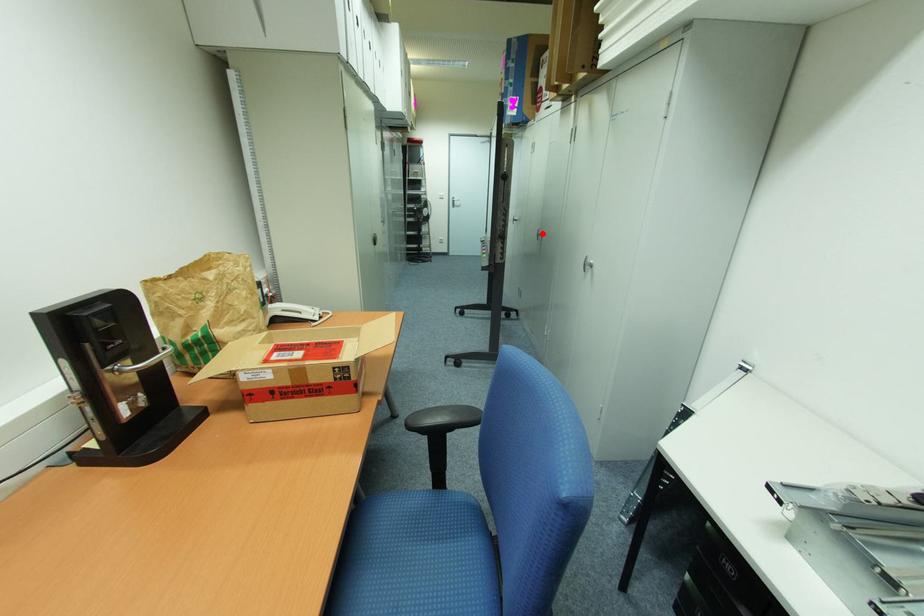
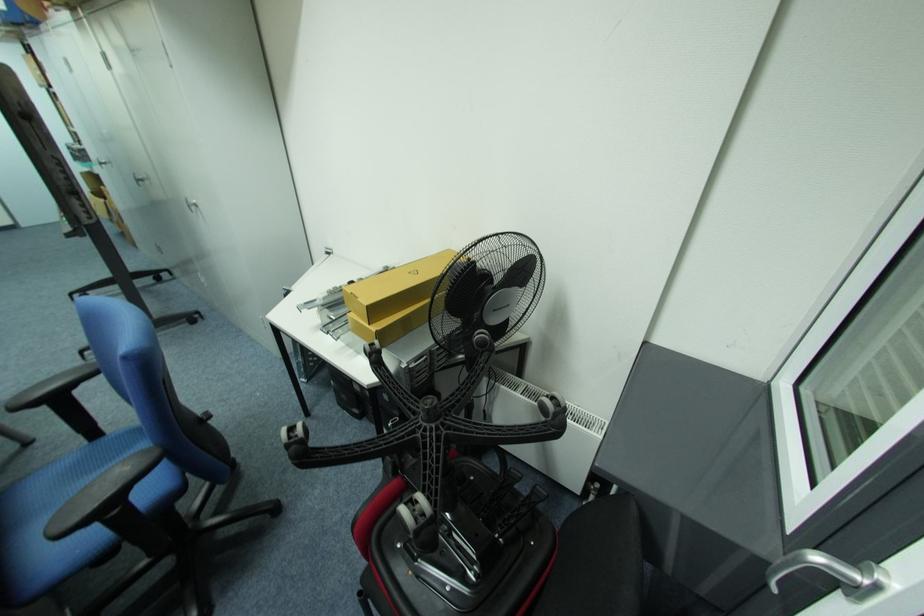
Where in the second image is the point corresponding to the highlighted location from the first image?

(141, 179)